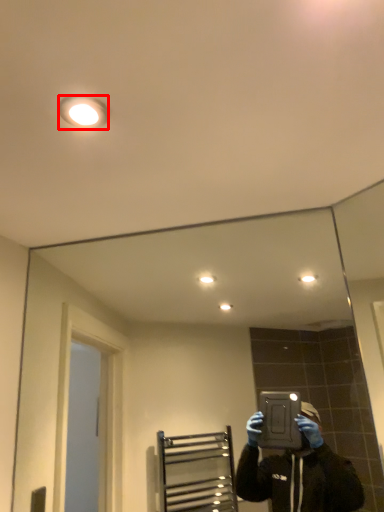
Question: Observing the image, what is the correct spatial positioning of light fixture (annotated by the red box) in reference to mirror?

Choices:
 (A) left
 (B) right

Answer: (A)